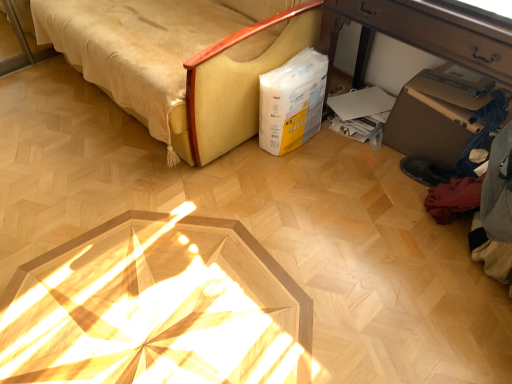
At what (x,y) coordinates should I click in order to perform the action: click on free spot in front of wooden desk at lower right. Please return your answer as a coordinate pair (x, y). Image resolution: width=512 pixels, height=384 pixels. Looking at the image, I should click on (381, 248).